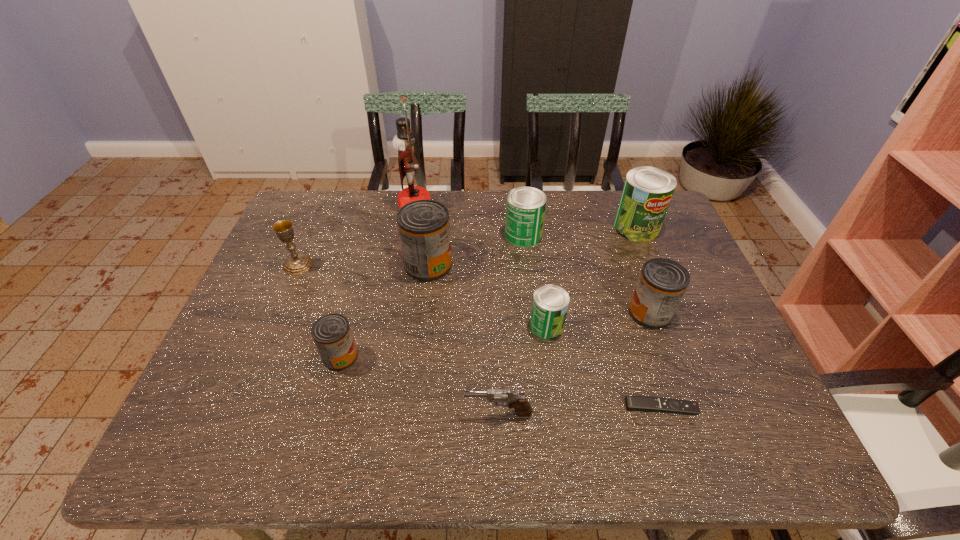
The height and width of the screenshot is (540, 960). What are the coordinates of `the tallest object` in the screenshot? It's located at click(x=404, y=141).

The image size is (960, 540). I want to click on red nutcracker, so click(x=404, y=141).

Find the location of a particular element. the second red can from right to left is located at coordinates (424, 229).

Locate an element on the screen. the fourth nearest can is located at coordinates pyautogui.click(x=424, y=229).

This screenshot has width=960, height=540. Identify the location of the rightmost green can. (647, 192).

Locate an element on the screen. Image resolution: width=960 pixels, height=540 pixels. gold chalice is located at coordinates (297, 263).

The height and width of the screenshot is (540, 960). What are the coordinates of `the leftmost object` in the screenshot? It's located at 297,263.

The image size is (960, 540). I want to click on the rightmost red can, so tap(662, 283).

Where is `the second farthest red can`? This screenshot has height=540, width=960. the second farthest red can is located at coordinates (662, 283).

Locate an element on the screen. This screenshot has height=540, width=960. the second biggest green can is located at coordinates (525, 206).